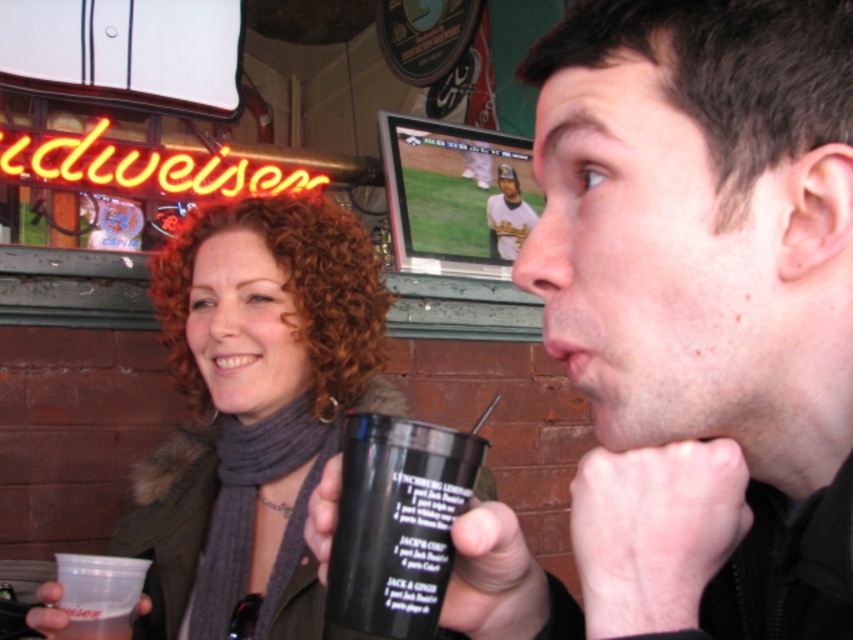
Question: Is matte black cup at right to the right of white jersey baseball player at upper center from the viewer's perspective?

Choices:
 (A) yes
 (B) no

Answer: (B)

Question: Which point is closer to the camera?

Choices:
 (A) matte black cup at right
 (B) black plastic cup at lower center
 (C) matte black cup at center

Answer: (A)

Question: Among these objects, which one is nearest to the camera?

Choices:
 (A) matte black cup at center
 (B) black plastic cup at lower center

Answer: (B)

Question: Can you confirm if matte black cup at center is positioned to the left of black plastic cup at lower center?

Choices:
 (A) no
 (B) yes

Answer: (B)

Question: Which point is closer to the camera taking this photo?

Choices:
 (A) (358, 500)
 (B) (506, 193)
 (C) (276, 250)
 (D) (747, 532)

Answer: (A)

Question: Is matte black cup at center closer to camera compared to white jersey baseball player at upper center?

Choices:
 (A) yes
 (B) no

Answer: (A)